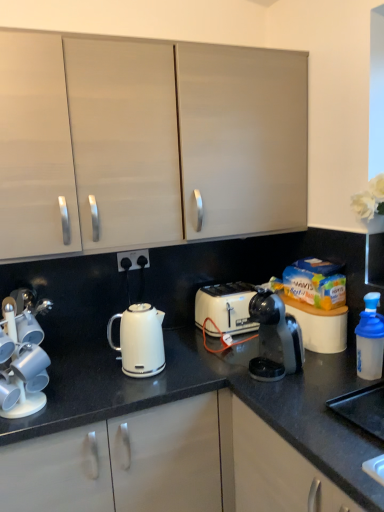
Question: From the image's perspective, relative to white glossy kettle at center, is white glossy cup holder at left above or below?

Choices:
 (A) below
 (B) above

Answer: (A)

Question: From their relative heights in the image, would you say white glossy cup holder at left is taller or shorter than white glossy kettle at center?

Choices:
 (A) tall
 (B) short

Answer: (A)

Question: Based on their relative distances, which object is farther from the black granite countertop at center?

Choices:
 (A) blue translucent bottle at right
 (B) black plastic coffee maker at center
 (C) white glossy kettle at center
 (D) white glossy cup holder at left
 (E) white plastic toaster at center

Answer: (A)

Question: Which of these objects is positioned closest to the white glossy kettle at center?

Choices:
 (A) black plastic electrical outlet at center
 (B) black plastic coffee maker at center
 (C) matte white cabinet at upper center
 (D) white glossy cup holder at left
 (E) black granite countertop at center

Answer: (E)